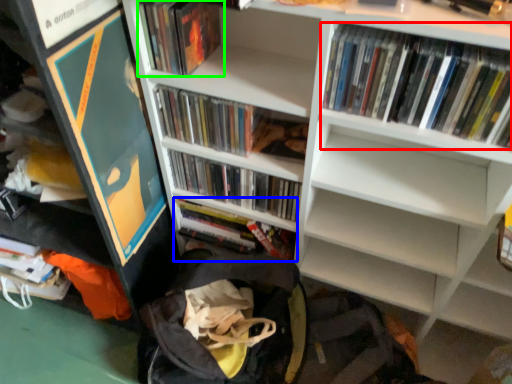
Question: Which object is the farthest from book (highlighted by a red box)? Choose among these: book (highlighted by a blue box) or book (highlighted by a green box).

Choices:
 (A) book
 (B) book

Answer: (A)